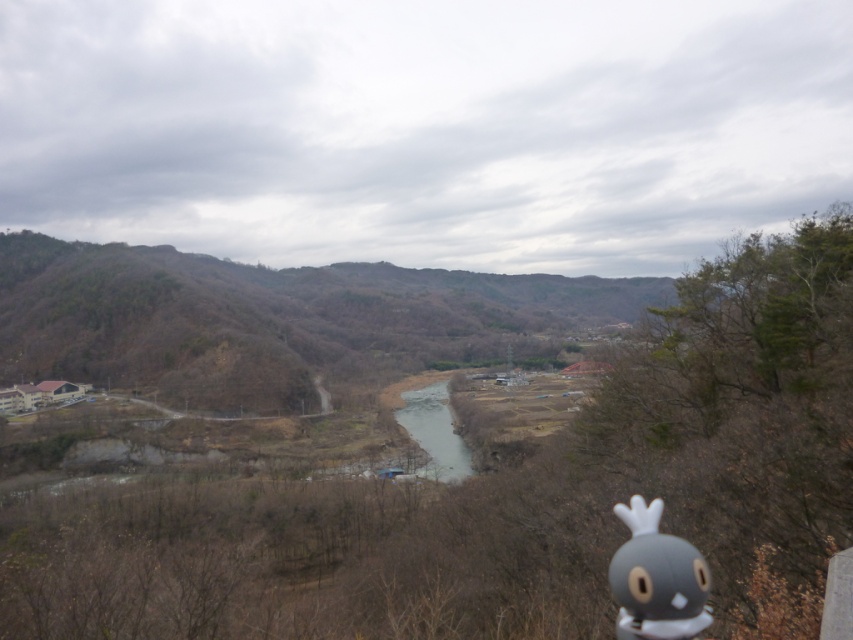
Question: Is gray matte toy at lower right further to the viewer compared to clear water at center?

Choices:
 (A) yes
 (B) no

Answer: (B)

Question: Does green leafy hillside at left have a lesser width compared to gray matte toy at lower right?

Choices:
 (A) yes
 (B) no

Answer: (B)

Question: Estimate the real-world distances between objects in this image. Which object is farther from the clear water at center?

Choices:
 (A) green leafy hillside at left
 (B) gray matte toy at lower right

Answer: (B)

Question: Can you confirm if gray matte toy at lower right is positioned below clear water at center?

Choices:
 (A) yes
 (B) no

Answer: (B)

Question: Which of these objects is positioned farthest from the green leafy hillside at left?

Choices:
 (A) clear water at center
 (B) gray matte toy at lower right

Answer: (B)

Question: Among these points, which one is farthest from the camera?

Choices:
 (A) (9, 369)
 (B) (465, 448)

Answer: (A)